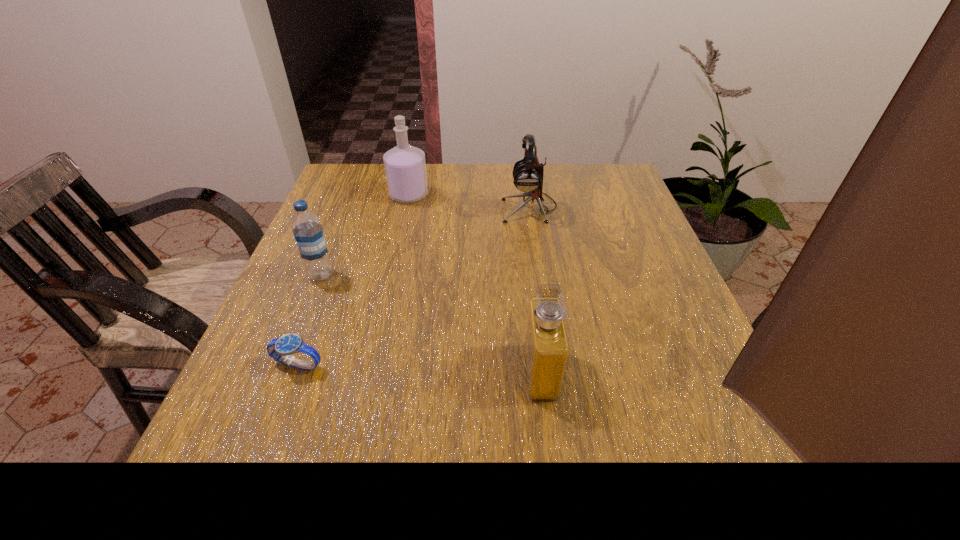
Where is `free point that satisfies the following two spatial constraints: 1. on the back side of the watch; 2. on the right side of the third object from left to right`? free point that satisfies the following two spatial constraints: 1. on the back side of the watch; 2. on the right side of the third object from left to right is located at coordinates (362, 195).